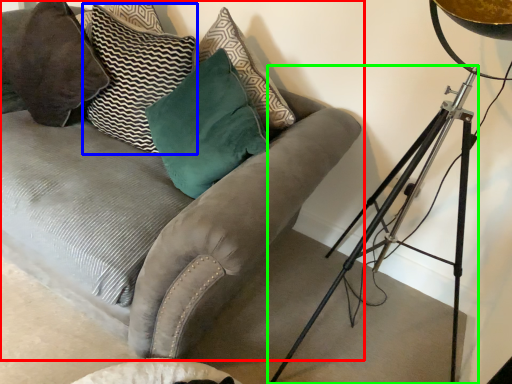
Question: Which object is positioned farthest from studio couch (highlighted by a red box)? Select from pillow (highlighted by a blue box) and tripod (highlighted by a green box).

Choices:
 (A) pillow
 (B) tripod

Answer: (B)